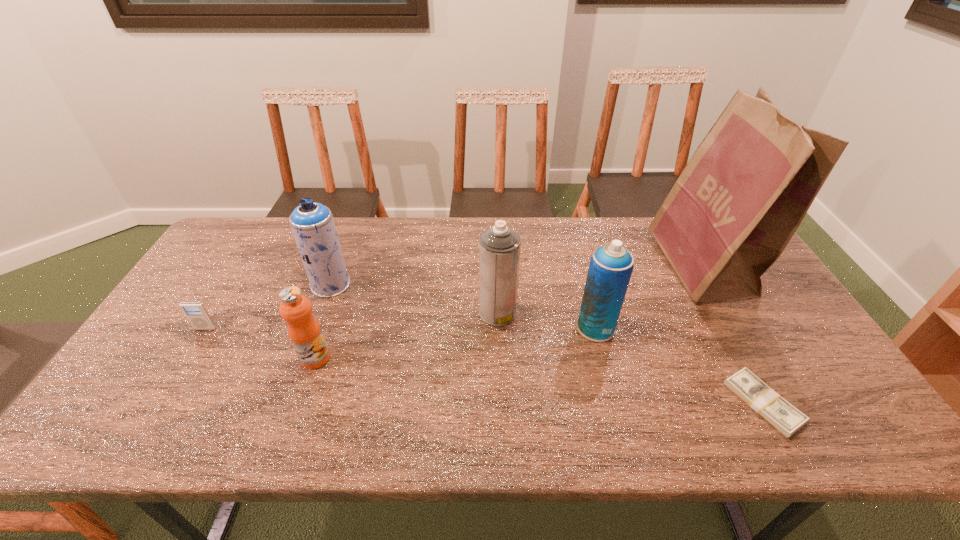
The image size is (960, 540). In order to click on free space between the third object from right to left and the sixth tallest object in this screenshot , I will do `click(400, 328)`.

Identify the location of free space between the rightmost aerosol can and the grocery bag. (648, 296).

Identify the location of vacant point located between the dollar and the fifth tallest object. (540, 381).

You are a GUI agent. You are given a task and a screenshot of the screen. Output one action in this format:
    pyautogui.click(x=<x>, y=<y>)
    Task: Click on the vacant space in between the grocery bag and the dollar
    The image size is (960, 540).
    Given the screenshot: What is the action you would take?
    pyautogui.click(x=732, y=334)

This screenshot has width=960, height=540. I want to click on unoccupied position between the fruit juice and the leftmost aerosol can, so click(x=323, y=321).

Where is `free space between the sixth farthest object and the rightmost aerosol can`? free space between the sixth farthest object and the rightmost aerosol can is located at coordinates (455, 343).

What are the coordinates of `unoccupied position between the fourth object from left to right and the rightmost aerosol can` in the screenshot? It's located at (546, 320).

Where is `free space between the farthest aerosol can and the fourth object from right to left`? The image size is (960, 540). free space between the farthest aerosol can and the fourth object from right to left is located at coordinates (414, 299).

You are a GUI agent. You are given a task and a screenshot of the screen. Output one action in this format:
    pyautogui.click(x=<x>, y=<y>)
    Task: Click on the vacant area that lies between the leftmost object and the leftmost aerosol can
    
    Given the screenshot: What is the action you would take?
    pyautogui.click(x=268, y=307)

Locate an element on the screen. Image resolution: width=960 pixels, height=540 pixels. free spot between the fifth tallest object and the rightmost aerosol can is located at coordinates (455, 343).